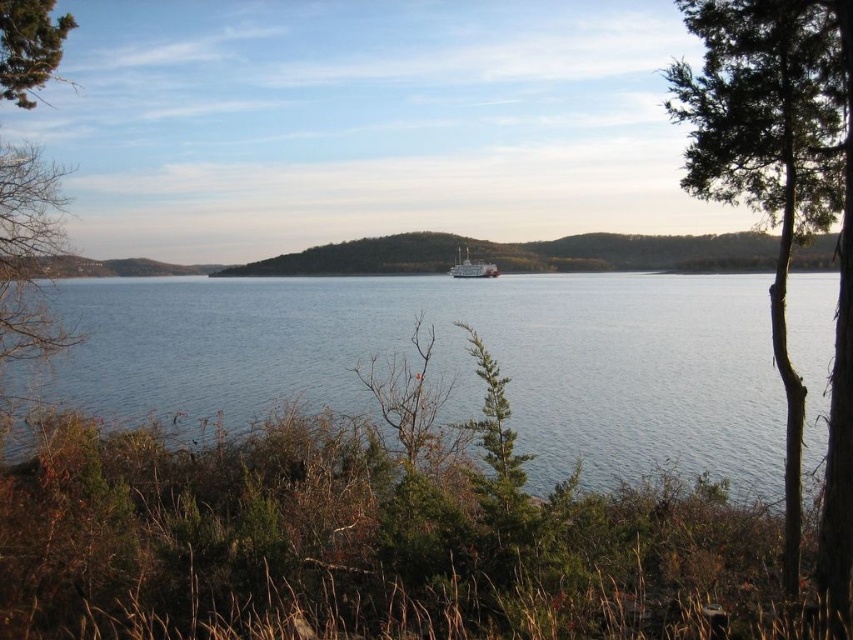
You are standing on the lakeside and want to take a photo of the blue water at center and the green leafy tree at right. Based on their positions, which object should you frame first in your camera viewfinder to ensure both are captured in the shot?

The blue water at center should be framed first since it is positioned to the left of the green leafy tree at right, so by starting with the water, you can adjust the viewfinder to include both objects.

You are planning to take a photo of the blue water at center and the green leafy tree at right. Which object should you focus on first if you want to capture both in a single frame without moving the camera?

The blue water at center is larger in size than the green leafy tree at right, so you should focus on the blue water at center first to ensure it fills the frame appropriately before adjusting for the smaller tree.

You are an observer standing at the lakeside. You notice the green leafy tree at upper left and the white matte boat at center. Which of these two objects appears wider in the scene?

The green leafy tree at upper left appears wider than the white matte boat at center because its width is larger than the boat.